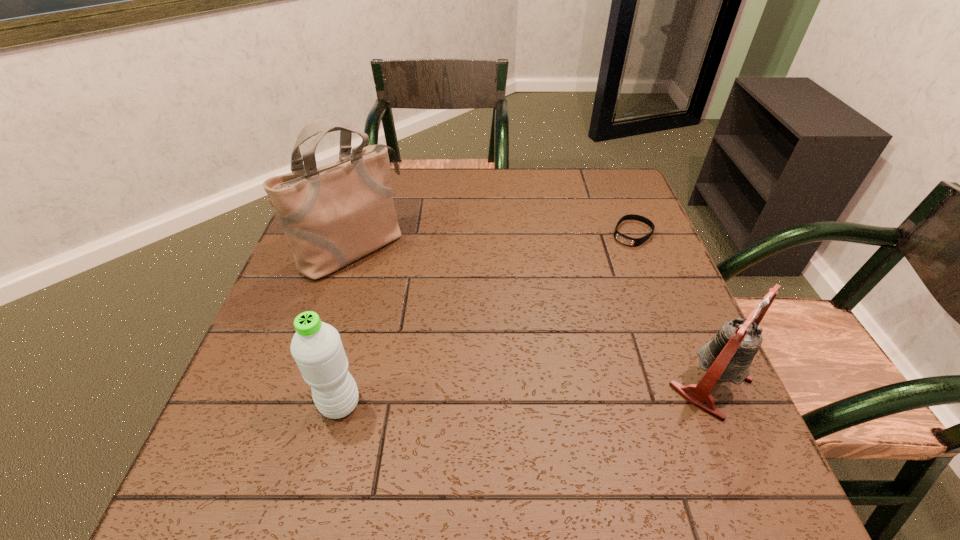
The image size is (960, 540). Identify the location of free space located on the front-facing side of the shoulder bag. (436, 318).

Locate an element on the screen. The width and height of the screenshot is (960, 540). vacant space situated 0.090m on the front-facing side of the shoulder bag is located at coordinates (405, 292).

Find the location of `water bottle positioned at the near edge`. water bottle positioned at the near edge is located at coordinates (317, 348).

Where is `bell present at the near edge`? This screenshot has height=540, width=960. bell present at the near edge is located at coordinates (727, 357).

What are the coordinates of `object positioned at the left edge` in the screenshot? It's located at (333, 215).

Where is `bell located at the right edge`? Image resolution: width=960 pixels, height=540 pixels. bell located at the right edge is located at coordinates (727, 357).

Locate an element on the screen. wristband positioned at the right edge is located at coordinates (632, 242).

The height and width of the screenshot is (540, 960). Identify the location of object that is at the near right corner. (727, 357).

This screenshot has height=540, width=960. In the image, there is a desktop. Identify the location of vacant space at the far edge. (555, 171).

In the image, there is a desktop. Identify the location of vacant space at the near edge. (611, 424).